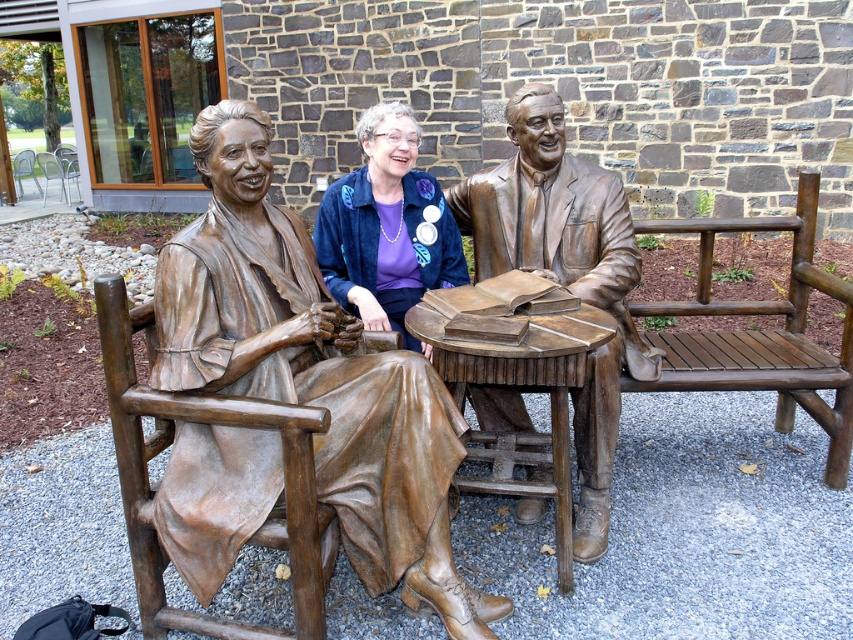
Question: Which is nearer to the bronze statue of man at center?

Choices:
 (A) bronze statue at center
 (B) blue velvet jacket at center

Answer: (B)

Question: Which object is closer to the camera taking this photo?

Choices:
 (A) bronze statue of man at center
 (B) blue velvet jacket at center
 (C) bronze statue at center

Answer: (C)

Question: Which point is closer to the camera taking this photo?

Choices:
 (A) (231, 324)
 (B) (602, 252)

Answer: (A)

Question: Does bronze statue at center appear on the left side of blue velvet jacket at center?

Choices:
 (A) no
 (B) yes

Answer: (B)

Question: Can you confirm if bronze statue at center is positioned above bronze statue of man at center?

Choices:
 (A) yes
 (B) no

Answer: (B)

Question: Observing the image, what is the correct spatial positioning of bronze statue at center in reference to bronze statue of man at center?

Choices:
 (A) right
 (B) left

Answer: (B)